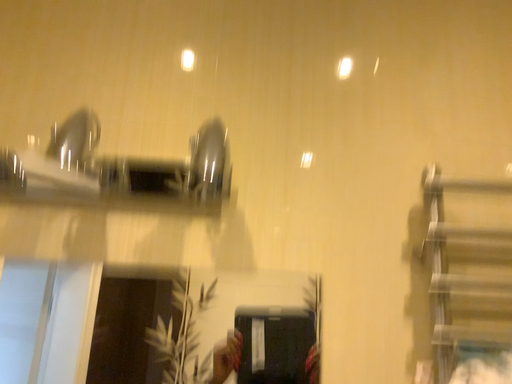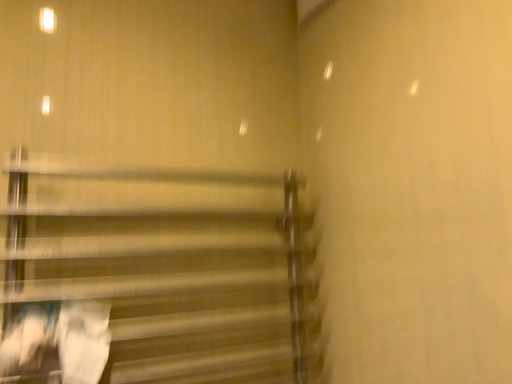
Question: How did the camera likely rotate when shooting the video?

Choices:
 (A) rotated upward
 (B) rotated downward

Answer: (B)